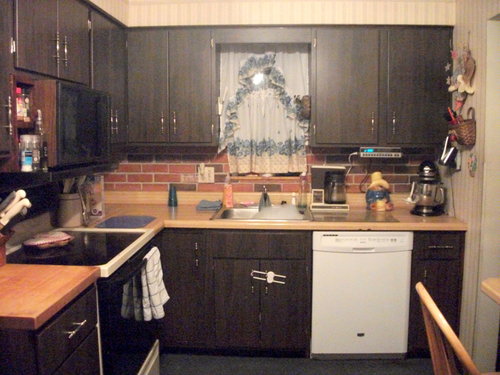
Where is `stove`? stove is located at coordinates (89, 251).